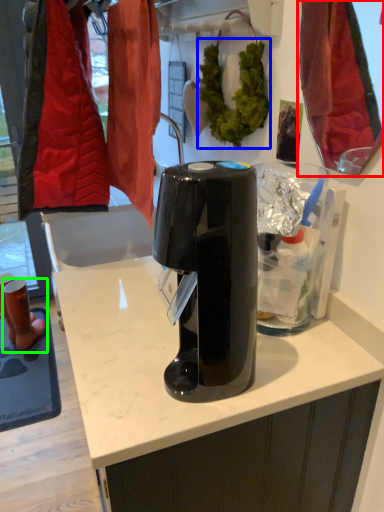
Question: Which object is positioned closest to mirror (highlighted by a red box)? Select from plant (highlighted by a blue box) and footwear (highlighted by a green box).

Choices:
 (A) plant
 (B) footwear

Answer: (A)